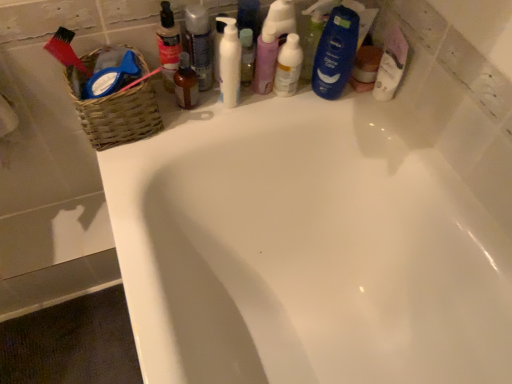
I want to click on free point to the right of translucent plastic bottle at upper center, positioned as the 3th toiletry in left-to-right order, so pyautogui.click(x=272, y=108).